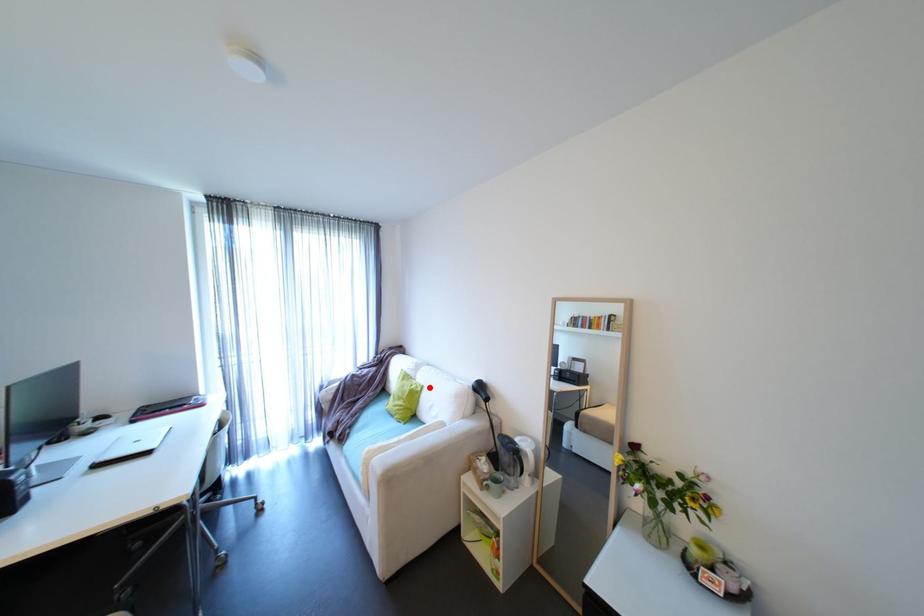
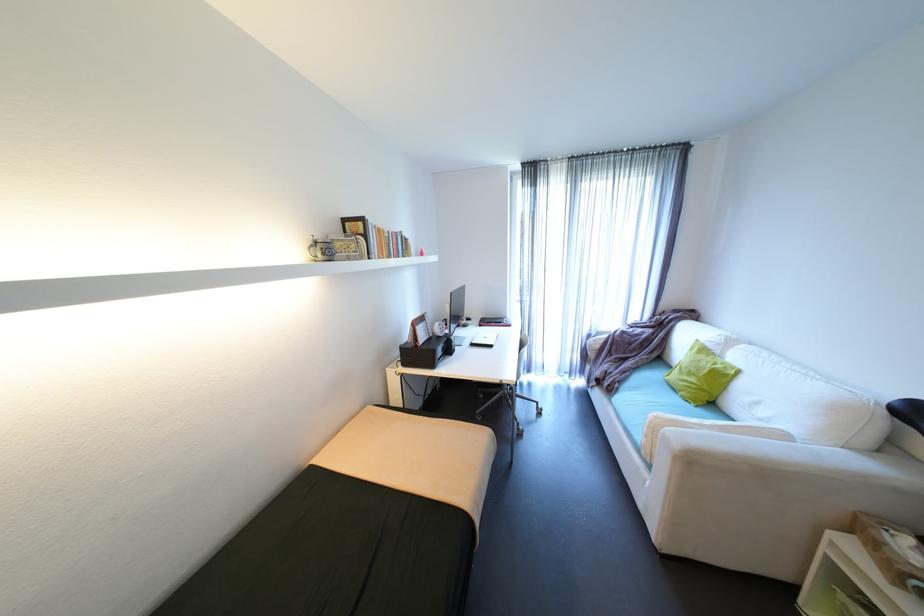
Locate, in the second image, the point that corresponds to the highlighted location in the first image.

(747, 371)